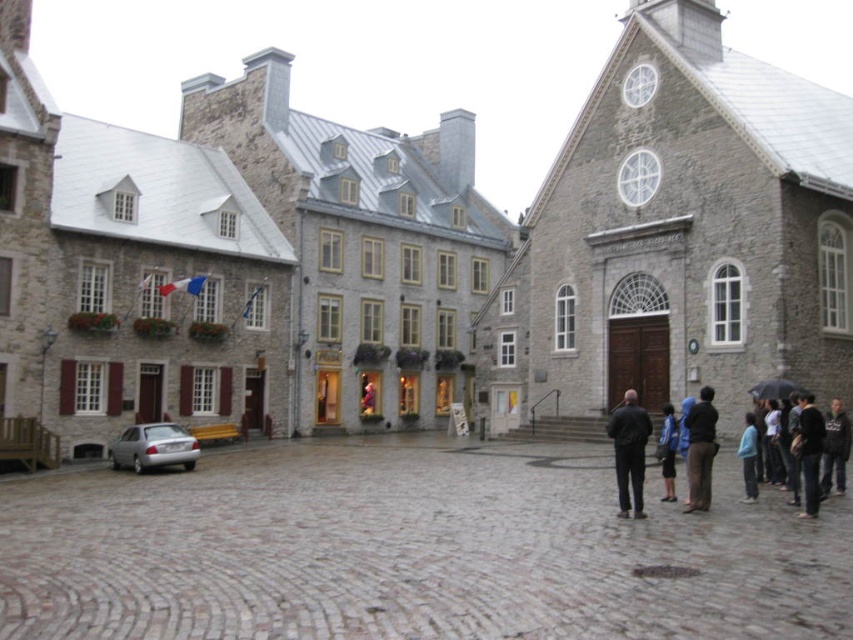
Question: Can you confirm if dark brown leather jacket at center is wider than blue cotton shirt at lower right?

Choices:
 (A) yes
 (B) no

Answer: (A)

Question: Which object appears closest to the camera in this image?

Choices:
 (A) dark gray sweater at lower right
 (B) dark brown leather jacket at center
 (C) gray cobblestone at center
 (D) black leather jacket at lower right

Answer: (C)

Question: Is stone church at center to the left of dark gray sweater at lower right from the viewer's perspective?

Choices:
 (A) yes
 (B) no

Answer: (A)

Question: Can you confirm if gray cobblestone at center is positioned above stone church at center?

Choices:
 (A) no
 (B) yes

Answer: (A)

Question: Considering the real-world distances, which object is farthest from the dark gray hoodie at lower right?

Choices:
 (A) black matte umbrella at lower right
 (B) black leather jacket at lower right
 (C) dark gray sweater at lower right

Answer: (B)

Question: Which is nearer to the gray cobblestone at center?

Choices:
 (A) black leather jacket at lower right
 (B) stone church at center
 (C) gray stone church at center

Answer: (A)